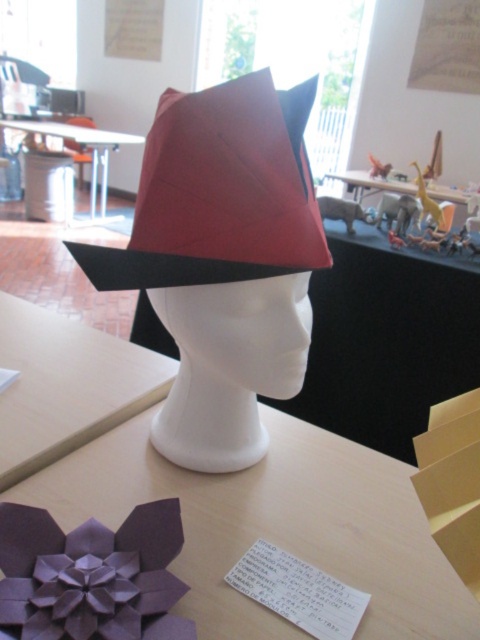
Question: Estimate the real-world distances between objects in this image. Which object is farther from the wooden at center?

Choices:
 (A) matte white table at center
 (B) matte paper hat at center

Answer: (A)

Question: Is wooden at center behind wooden table at center?

Choices:
 (A) yes
 (B) no

Answer: (B)

Question: Which of these objects is positioned farthest from the matte paper hat at center?

Choices:
 (A) matte white table at center
 (B) wooden at center
 (C) wooden table at center
 (D) purple paper flower at center

Answer: (A)

Question: Which of the following is the closest to the observer?

Choices:
 (A) (1, 122)
 (B) (37, 316)
 (C) (188, 257)

Answer: (C)

Question: Does matte paper hat at center have a larger size compared to matte white table at center?

Choices:
 (A) no
 (B) yes

Answer: (A)

Question: Does matte paper hat at center come in front of matte white table at center?

Choices:
 (A) no
 (B) yes

Answer: (B)